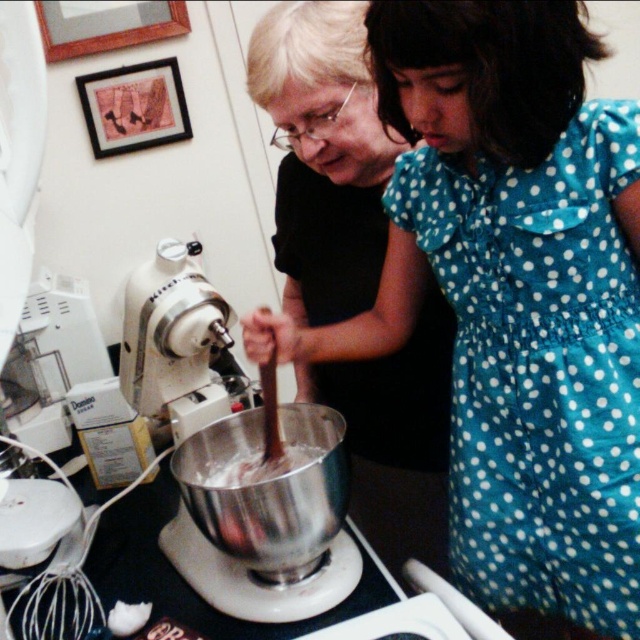
Question: Estimate the real-world distances between objects in this image. Which object is closer to the matte black stand mixer at center?

Choices:
 (A) white plastic mixer at center
 (B) smooth chocolate batter at center

Answer: (A)

Question: Is matte black stand mixer at center positioned behind white plastic stand mixer at center?

Choices:
 (A) yes
 (B) no

Answer: (B)

Question: Which point is closer to the camera?

Choices:
 (A) white plastic mixer at center
 (B) white plastic stand mixer at center
 (C) black matte stand mixer at center

Answer: (C)

Question: Which of these objects is positioned farthest from the smooth chocolate batter at center?

Choices:
 (A) white plastic mixer at center
 (B) black matte stand mixer at center

Answer: (B)

Question: Is matte black stand mixer at center smaller than smooth chocolate batter at center?

Choices:
 (A) no
 (B) yes

Answer: (A)

Question: Is white plastic mixer at center further to the viewer compared to white plastic stand mixer at center?

Choices:
 (A) no
 (B) yes

Answer: (A)